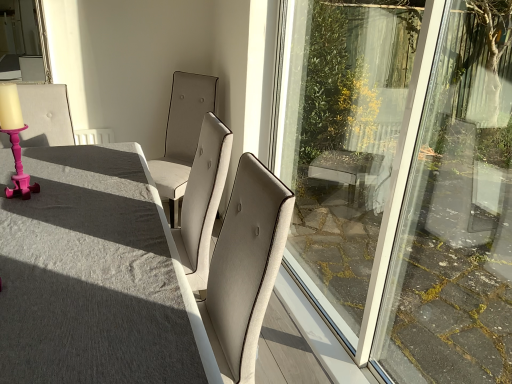
Question: From a real-world perspective, is pink wood candle holder at left below pink plastic candlestick at left, placed as the first chair when sorted from left to right?

Choices:
 (A) no
 (B) yes

Answer: (A)

Question: Is pink wood candle holder at left positioned before pink plastic candlestick at left, the second chair when ordered from right to left?

Choices:
 (A) no
 (B) yes

Answer: (B)

Question: Is pink wood candle holder at left looking in the opposite direction of pink plastic candlestick at left, the second chair when ordered from right to left?

Choices:
 (A) no
 (B) yes

Answer: (A)

Question: From a real-world perspective, is pink wood candle holder at left over pink plastic candlestick at left, the second chair when ordered from right to left?

Choices:
 (A) no
 (B) yes

Answer: (B)

Question: Can you see pink wood candle holder at left touching pink plastic candlestick at left, the second chair when ordered from right to left?

Choices:
 (A) yes
 (B) no

Answer: (B)

Question: In the image, is satin beige chair at center, which is the 2th chair in left-to-right order, positioned in front of or behind pink wood candle holder at left?

Choices:
 (A) behind
 (B) front

Answer: (A)

Question: Is satin beige chair at center, which is the 1th chair in right-to-left order, inside the boundaries of pink wood candle holder at left, or outside?

Choices:
 (A) outside
 (B) inside

Answer: (A)

Question: From their relative heights in the image, would you say satin beige chair at center, which is the 2th chair in left-to-right order, is taller or shorter than pink wood candle holder at left?

Choices:
 (A) tall
 (B) short

Answer: (A)

Question: From the image's perspective, relative to pink wood candle holder at left, is satin beige chair at center, which is the 1th chair in right-to-left order, above or below?

Choices:
 (A) below
 (B) above

Answer: (B)

Question: From the image's perspective, is matte gray table at center above or below pink wood candle holder at left?

Choices:
 (A) above
 (B) below

Answer: (B)

Question: In the image, is matte gray table at center on the left side or the right side of pink wood candle holder at left?

Choices:
 (A) left
 (B) right

Answer: (B)

Question: From their relative heights in the image, would you say matte gray table at center is taller or shorter than pink wood candle holder at left?

Choices:
 (A) short
 (B) tall

Answer: (B)

Question: Considering their positions, is matte gray table at center located in front of or behind pink wood candle holder at left?

Choices:
 (A) behind
 (B) front

Answer: (B)

Question: From the image's perspective, relative to satin beige chair at center, which is the 1th chair in right-to-left order, is matte gray table at center above or below?

Choices:
 (A) below
 (B) above

Answer: (A)

Question: Is matte gray table at center inside the boundaries of satin beige chair at center, which is the 2th chair in left-to-right order, or outside?

Choices:
 (A) inside
 (B) outside

Answer: (B)